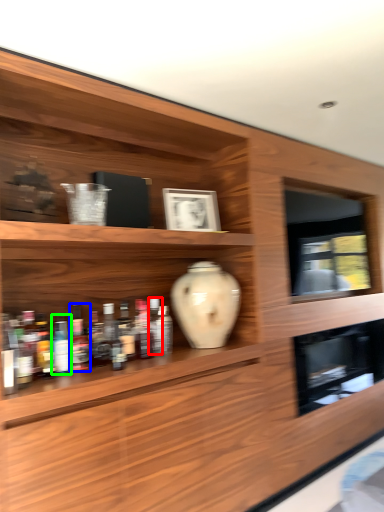
Question: Based on their relative distances, which object is farther from bottle (highlighted by a red box)? Choose from bottle (highlighted by a blue box) and bottle (highlighted by a green box).

Choices:
 (A) bottle
 (B) bottle

Answer: (B)